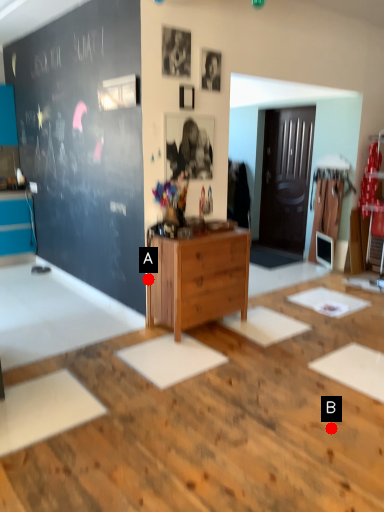
Question: Two points are circled on the image, labeled by A and B beside each circle. Which point is closer to the camera?

Choices:
 (A) A is closer
 (B) B is closer

Answer: (B)